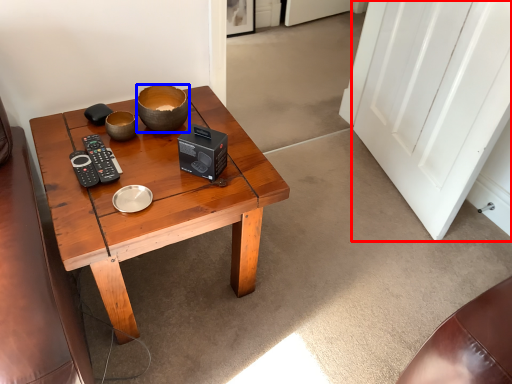
Question: Which object appears closest to the camera in this image, door (highlighted by a red box) or bowl (highlighted by a blue box)?

Choices:
 (A) door
 (B) bowl

Answer: (A)